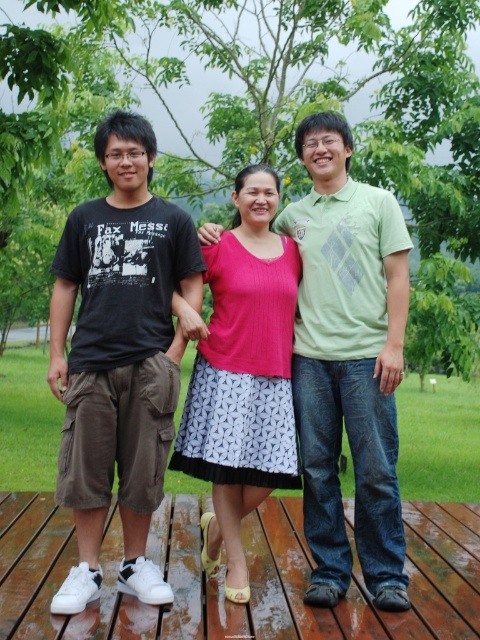
You are organizing a picnic on the wooden deck and want to place a rectangular picnic basket between the wooden at center and the green matte shirt at center. Given that the basket is 1 meter long, can it fit between them without overlapping either object?

The wooden at center is wider than the green matte shirt at center. However, the description does not provide specific measurements of the distance between them. Therefore, it is impossible to determine if the 1 meter long picnic basket can fit without overlapping either object based on the given information.